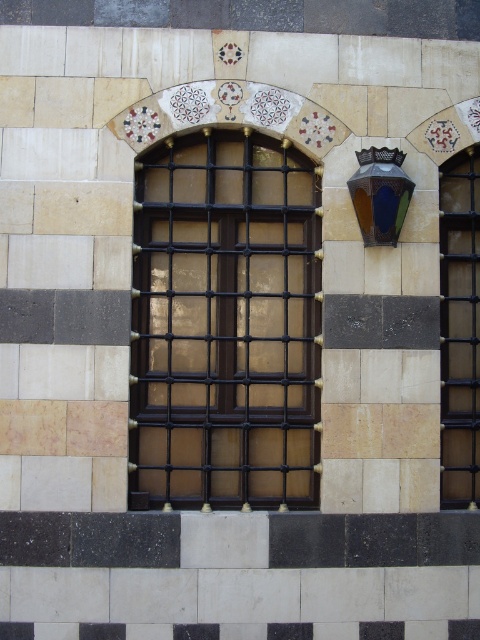
You are standing in front of the building and see two points marked on the facade. The first point is at coordinates point (289, 445) and the second is at point (469, 212). Which point is closer to you?

Point (289, 445) is closer to the camera than point (469, 212), so the first point is closer to you.

Based on the photo, you are standing at the point labeled point (300, 353). You want to walk to the entrance of the building, which is located at the other end of the facade. If your walking speed is 3 feet per second, how many seconds will it take you to reach the entrance?

The distance between point (300, 353) and the entrance is 29.92 feet. At a speed of 3 feet per second, it will take approximately 9.97 seconds to reach the entrance.